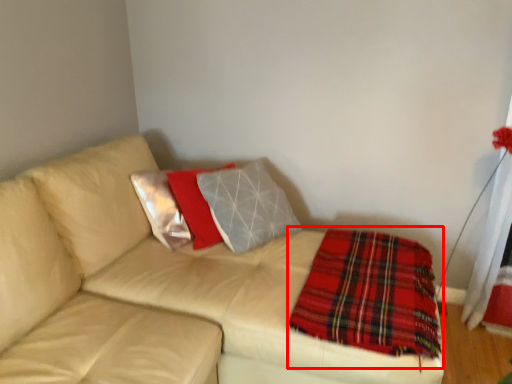
Question: In this image, where is blanket (annotated by the red box) located relative to studio couch?

Choices:
 (A) right
 (B) left

Answer: (A)